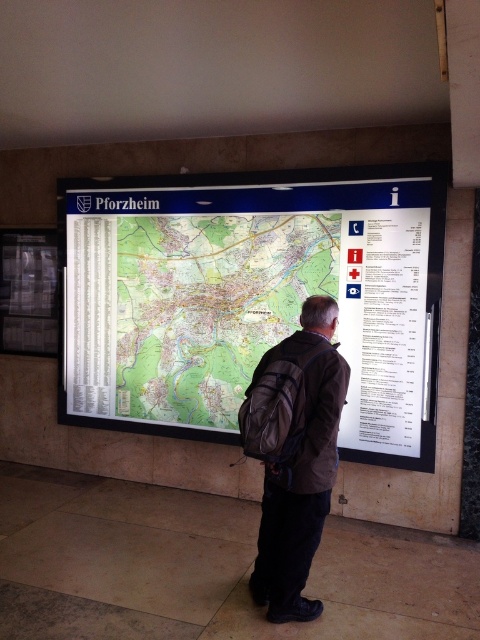
Based on the photo, between green paper map at center and brown fabric backpack at center, which one is positioned lower?

Result: Positioned lower is brown fabric backpack at center.

Can you confirm if green paper map at center is positioned to the left of brown fabric backpack at center?

Correct, you'll find green paper map at center to the left of brown fabric backpack at center.

Where is `green paper map at center`? green paper map at center is located at coordinates (250, 298).